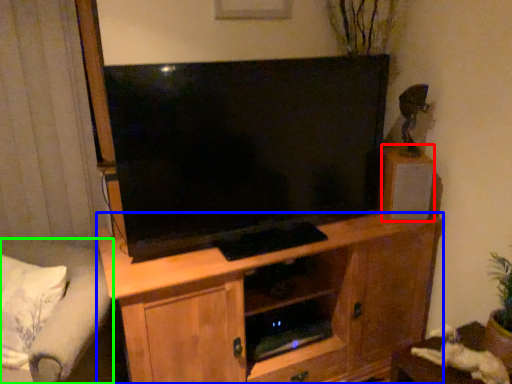
Question: Which object is the farthest from loudspeaker (highlighted by a red box)? Choose among these: cabinetry (highlighted by a blue box) or studio couch (highlighted by a green box).

Choices:
 (A) cabinetry
 (B) studio couch

Answer: (B)